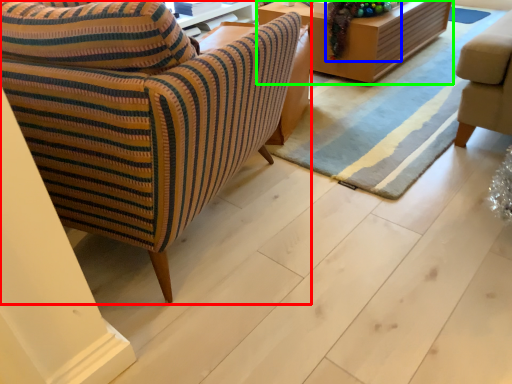
Question: Estimate the real-world distances between objects in this image. Which object is closer to chair (highlighted by a red box), christmas decoration (highlighted by a blue box) or table (highlighted by a green box)?

Choices:
 (A) christmas decoration
 (B) table

Answer: (A)